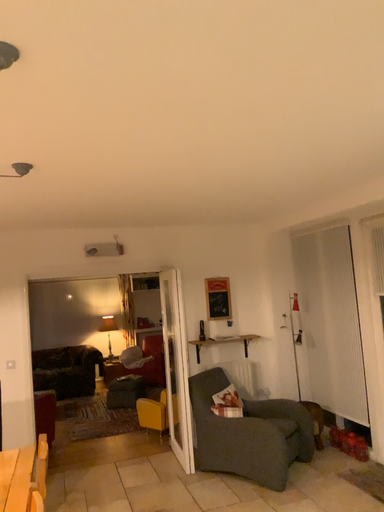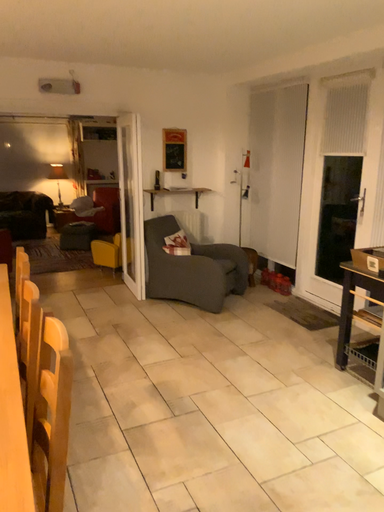
Question: How did the camera likely rotate when shooting the video?

Choices:
 (A) rotated downward
 (B) rotated upward

Answer: (A)